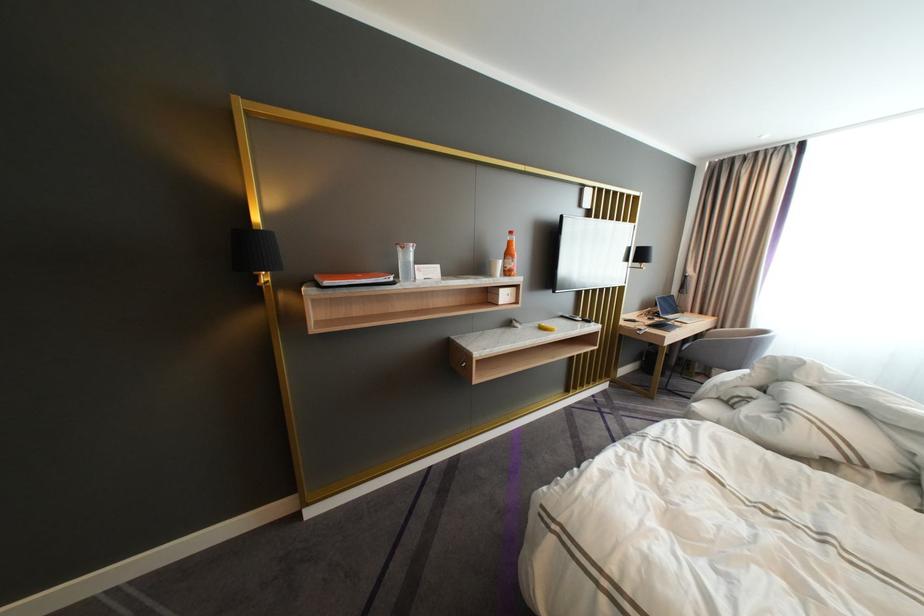
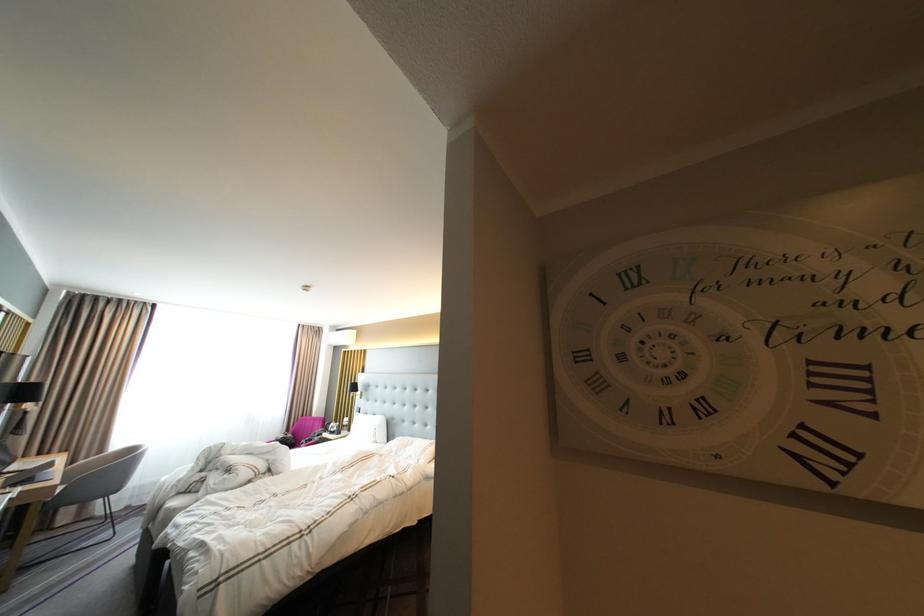
Question: I am providing you with two images of the same scene from different viewpoints. Which of the following objects are not visible in image2?

Choices:
 (A) laptop computer
 (B) white kettle handle
 (C) black desk lamp
 (D) none of these

Answer: (D)